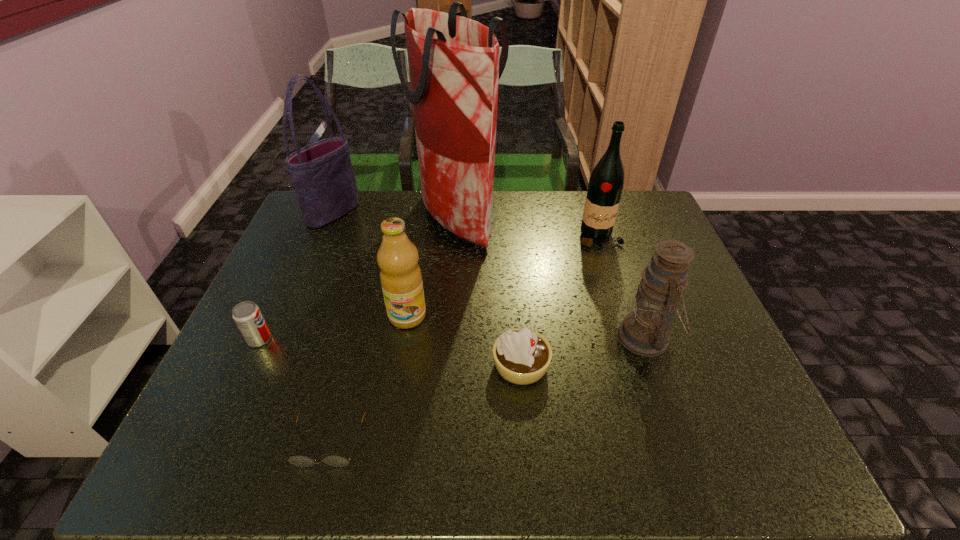
You are a GUI agent. You are given a task and a screenshot of the screen. Output one action in this format:
    pyautogui.click(x=<x>, y=<y>)
    Task: Click on the vacant space in between the wine bottle and the soda
    
    Given the screenshot: What is the action you would take?
    pyautogui.click(x=429, y=288)

The image size is (960, 540). What are the coordinates of `empty space between the oil lamp and the whipped cream` in the screenshot? It's located at (584, 351).

The width and height of the screenshot is (960, 540). I want to click on free space between the tallest object and the nearest object, so click(x=393, y=331).

Locate which object is the closest to the nearest object. Please provide its 2D coordinates. Your answer should be formatted as a tuple, i.e. [(x, y)], where the tuple contains the x and y coordinates of a point satisfying the conditions above.

[(247, 315)]

Locate an element on the screen. The width and height of the screenshot is (960, 540). the fourth closest object to the tallest object is located at coordinates (522, 356).

Find the location of a particular element. The image size is (960, 540). vacant space that satisfies the following two spatial constraints: 1. on the label of the whipped cream; 2. on the right side of the olive oil is located at coordinates (399, 366).

Find the location of a particular element. The height and width of the screenshot is (540, 960). vacant space that satisfies the following two spatial constraints: 1. on the label of the olive oil; 2. on the right side of the oil lamp is located at coordinates click(x=404, y=337).